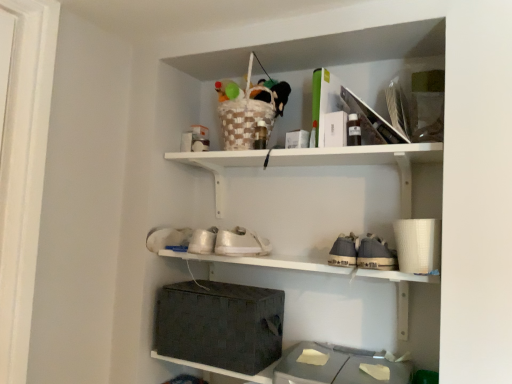
Question: From the image's perspective, is white matte shelf at upper center, the first shelf positioned from the top, under white matte shoe at lower left, which is the 2th shoe from right to left?

Choices:
 (A) no
 (B) yes

Answer: (A)

Question: Considering the relative sizes of white matte shelf at upper center, which is the second shelf in bottom-to-top order, and white matte shoe at lower left, which is the 2th shoe from right to left, in the image provided, is white matte shelf at upper center, which is the second shelf in bottom-to-top order, smaller than white matte shoe at lower left, which is the 2th shoe from right to left,?

Choices:
 (A) no
 (B) yes

Answer: (A)

Question: Are white matte shelf at upper center, the first shelf positioned from the top, and white matte shoe at lower left, the first shoe in the left-to-right sequence, making contact?

Choices:
 (A) yes
 (B) no

Answer: (B)

Question: Does white matte shelf at upper center, the first shelf positioned from the top, have a greater width compared to white matte shoe at lower left, which is the 2th shoe from right to left?

Choices:
 (A) yes
 (B) no

Answer: (B)

Question: Would you say white matte shelf at upper center, which is the second shelf in bottom-to-top order, is outside white matte shoe at lower left, the first shoe in the left-to-right sequence?

Choices:
 (A) no
 (B) yes

Answer: (B)

Question: In terms of height, does gray woven basket at lower center, the first storage box when ordered from right to left, look taller or shorter compared to white matte shoe at lower left, the first shoe in the left-to-right sequence?

Choices:
 (A) tall
 (B) short

Answer: (A)

Question: From a real-world perspective, relative to white matte shoe at lower left, the first shoe in the left-to-right sequence, is gray woven basket at lower center, the first storage box when ordered from right to left, vertically above or below?

Choices:
 (A) below
 (B) above

Answer: (A)

Question: From the image's perspective, is gray woven basket at lower center, which ranks as the 2th storage box in left-to-right order, positioned above or below white matte shoe at lower left, which is the 2th shoe from right to left?

Choices:
 (A) below
 (B) above

Answer: (A)

Question: Based on their sizes in the image, would you say gray woven basket at lower center, which ranks as the 2th storage box in left-to-right order, is bigger or smaller than white matte shoe at lower left, which is the 2th shoe from right to left?

Choices:
 (A) small
 (B) big

Answer: (B)

Question: Considering their positions, is woven fabric basket at center, which appears as the 1th shelf when ordered from the bottom, located in front of or behind white matte shelf at upper center, which is the second shelf in bottom-to-top order?

Choices:
 (A) behind
 (B) front

Answer: (B)

Question: From a real-world perspective, is woven fabric basket at center, which appears as the 1th shelf when ordered from the bottom, above or below white matte shelf at upper center, which is the second shelf in bottom-to-top order?

Choices:
 (A) below
 (B) above

Answer: (A)

Question: Considering the positions of point (153, 357) and point (187, 157), is point (153, 357) closer or farther from the camera than point (187, 157)?

Choices:
 (A) closer
 (B) farther

Answer: (A)

Question: Would you say woven fabric basket at center, which appears as the 1th shelf when ordered from the bottom, is to the left or to the right of white matte shelf at upper center, which is the second shelf in bottom-to-top order, in the picture?

Choices:
 (A) left
 (B) right

Answer: (A)

Question: Is white matte shoe at lower left, the first shoe in the left-to-right sequence, in front of or behind woven fabric basket at center, which appears as the 1th shelf when ordered from the bottom, in the image?

Choices:
 (A) front
 (B) behind

Answer: (B)

Question: Is white matte shoe at lower left, the first shoe in the left-to-right sequence, to the left or to the right of woven fabric basket at center, which appears as the 1th shelf when ordered from the bottom, in the image?

Choices:
 (A) left
 (B) right

Answer: (A)